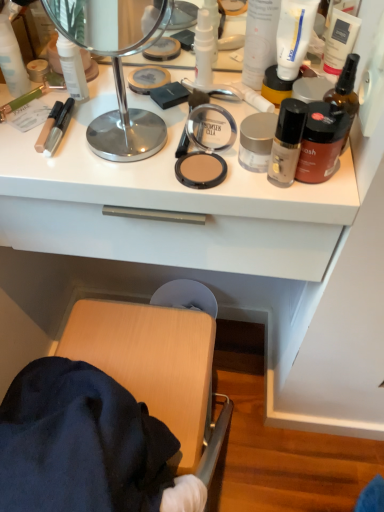
Question: Considering the positions of point (261, 38) and point (129, 129), is point (261, 38) closer or farther from the camera than point (129, 129)?

Choices:
 (A) farther
 (B) closer

Answer: (A)

Question: Considering their positions, is white matte lotion at upper right, positioned as the 6th toiletry in right-to-left order, located in front of or behind polished silver mirror at upper center?

Choices:
 (A) behind
 (B) front

Answer: (A)

Question: Estimate the real-world distances between objects in this image. Which object is farther from the white matte lotion at upper right, positioned as the 6th toiletry in right-to-left order?

Choices:
 (A) polished silver mirror at upper center
 (B) yellow matte jar at upper right, the 4th toiletry from the right
 (C) satin silver jar at upper center, the seventh toiletry positioned from the right
 (D) white matte spray bottle at center, which appears as the third toiletry when viewed from the left
 (E) white matte countertop at upper center

Answer: (A)

Question: Which is nearer to the white matte tube at upper right, which is the third toiletry in right-to-left order?

Choices:
 (A) yellow matte jar at upper right, the 4th toiletry from the right
 (B) matte white lotion at upper left, which is counted as the tenth toiletry, starting from the right
 (C) white matte countertop at upper center
 (D) white matte spray bottle at center, the 8th toiletry from the right
 (E) white matte lotion at upper right, positioned as the 6th toiletry in right-to-left order

Answer: (E)